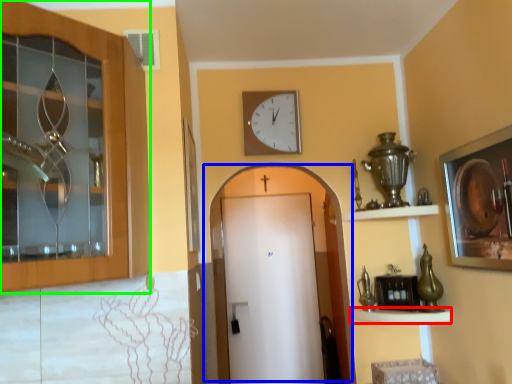
Question: Estimate the real-world distances between objects in this image. Which object is closer to shelf (highlighted by a red box), door (highlighted by a blue box) or door (highlighted by a green box)?

Choices:
 (A) door
 (B) door

Answer: (B)